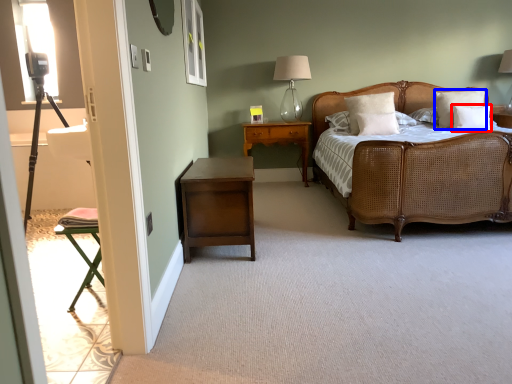
Question: Which of the following is the closest to the observer, pillow (highlighted by a red box) or pillow (highlighted by a blue box)?

Choices:
 (A) pillow
 (B) pillow

Answer: (A)